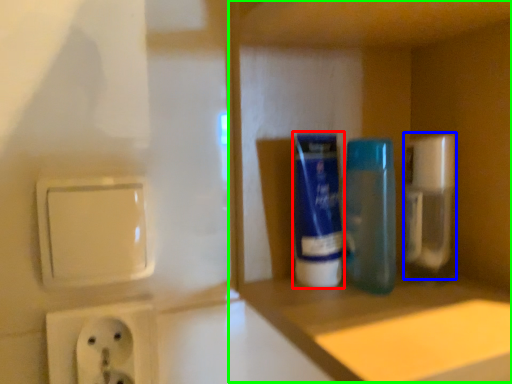
Question: Which object is positioned farthest from mouthwash (highlighted by a red box)? Select from cleaning product (highlighted by a blue box) and cabinet (highlighted by a green box).

Choices:
 (A) cleaning product
 (B) cabinet

Answer: (A)